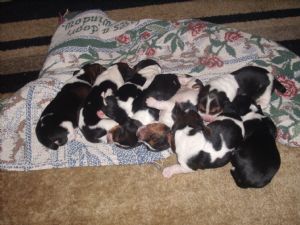
This screenshot has height=225, width=300. What are the coordinates of `green leaves design on quilt` in the screenshot? It's located at (95, 53), (201, 66), (284, 55), (263, 61).